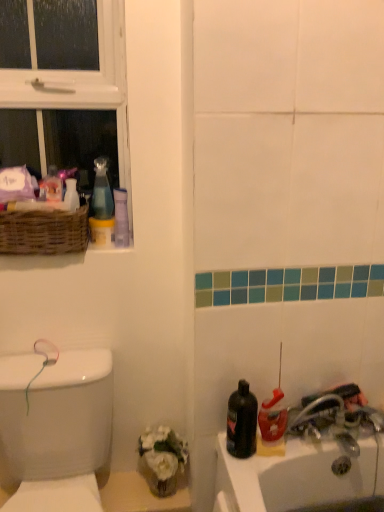
Question: Choose the correct answer: Is translucent plastic spray bottle at lower right, which ranks as the second cleaning product in top-to-bottom order, inside woven brown basket at upper left or outside it?

Choices:
 (A) outside
 (B) inside

Answer: (A)

Question: Looking at their shapes, would you say translucent plastic spray bottle at lower right, placed as the first cleaning product when sorted from right to left, is wider or thinner than woven brown basket at upper left?

Choices:
 (A) wide
 (B) thin

Answer: (B)

Question: Which object is the closest to the metallic silver faucet at lower right?

Choices:
 (A) white glossy vase at upper left
 (B) transparent plastic spray bottle at upper left, the first cleaning product viewed from the back
 (C) white plastic window at upper left
 (D) white glossy porcelain at left
 (E) translucent plastic spray bottle at lower right, placed as the first cleaning product when sorted from right to left

Answer: (E)

Question: Which object is the closest to the transparent plastic spray bottle at upper left, acting as the 2th cleaning product starting from the right?

Choices:
 (A) metallic silver faucet at lower right
 (B) white glossy porcelain at left
 (C) black matte bottle at lower right
 (D) white plastic window at upper left
 (E) woven brown basket at upper left

Answer: (E)